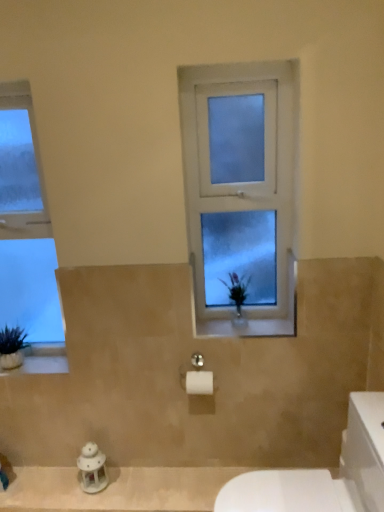
At what (x,y) coordinates should I click in order to perform the action: click on frosted glass window at center, the 2th window from the left. Please return your answer as a coordinate pair (x, y). This screenshot has width=384, height=512. Looking at the image, I should click on (241, 193).

Describe the element at coordinates (92, 468) in the screenshot. I see `white porcelain lantern at lower left` at that location.

What is the approximate height of white stone window sill at lower left?

The height of white stone window sill at lower left is 0.55 inches.

Find the location of a particular element. frosted glass window at center, positioned as the first window in right-to-left order is located at coordinates (241, 193).

How many degrees apart are the facing directions of clear glass window at left, the first window positioned from the left, and white glossy porcelain at lower right?

There is a 90-degree angle between the facing directions of clear glass window at left, the first window positioned from the left, and white glossy porcelain at lower right.

Is clear glass window at left, the first window positioned from the left, wider than white glossy porcelain at lower right?

In fact, clear glass window at left, the first window positioned from the left, might be narrower than white glossy porcelain at lower right.

Which is in front, point (39, 355) or point (264, 492)?

The point (264, 492) is closer.

Is clear glass window at left, the first window positioned from the left, turned away from white glossy porcelain at lower right?

clear glass window at left, the first window positioned from the left, is not turned away from white glossy porcelain at lower right.

Considering the positions of point (258, 490) and point (89, 492), is point (258, 490) closer or farther from the camera than point (89, 492)?

Point (258, 490) is positioned closer to the camera compared to point (89, 492).

Can you confirm if white glossy porcelain at lower right is taller than white porcelain lantern at lower left?

Yes, white glossy porcelain at lower right is taller than white porcelain lantern at lower left.

How many degrees apart are the facing directions of white glossy porcelain at lower right and white porcelain lantern at lower left?

The angular difference between white glossy porcelain at lower right and white porcelain lantern at lower left is 90 degrees.

Find the location of `porcelain above the white porcelain lantern at lower left (from a real-world perspective)`. porcelain above the white porcelain lantern at lower left (from a real-world perspective) is located at coordinates (322, 473).

Is frosted glass window at center, positioned as the first window in right-to-left order, taller or shorter than white porcelain lantern at lower left?

frosted glass window at center, positioned as the first window in right-to-left order, is taller than white porcelain lantern at lower left.

Is frosted glass window at center, positioned as the first window in right-to-left order, inside or outside of white porcelain lantern at lower left?

frosted glass window at center, positioned as the first window in right-to-left order, is spatially situated outside white porcelain lantern at lower left.

The image size is (384, 512). Identify the location of window that is on the right side of white porcelain lantern at lower left. (241, 193).

Consider the image. From the image's perspective, is frosted glass window at center, positioned as the first window in right-to-left order, located above white porcelain lantern at lower left?

Yes.

Considering the sizes of objects white porcelain lantern at lower left and white glossy porcelain at lower right in the image provided, who is wider, white porcelain lantern at lower left or white glossy porcelain at lower right?

With larger width is white glossy porcelain at lower right.

Does point (87, 480) come behind point (382, 454)?

Yes.

Does white porcelain lantern at lower left touch white glossy porcelain at lower right?

No, white porcelain lantern at lower left is not touching white glossy porcelain at lower right.

From the image's perspective, is frosted glass window at center, positioned as the first window in right-to-left order, located above white stone window sill at lower left?

Correct, frosted glass window at center, positioned as the first window in right-to-left order, appears higher than white stone window sill at lower left in the image.

Can you confirm if frosted glass window at center, positioned as the first window in right-to-left order, is positioned to the right of white stone window sill at lower left?

Yes, frosted glass window at center, positioned as the first window in right-to-left order, is to the right of white stone window sill at lower left.

Find the location of a particular element. Image resolution: width=384 pixels, height=512 pixels. window sill behind the frosted glass window at center, positioned as the first window in right-to-left order is located at coordinates (41, 360).

How different are the orientations of frosted glass window at center, positioned as the first window in right-to-left order, and white stone window sill at lower left in degrees?

The angle between the facing direction of frosted glass window at center, positioned as the first window in right-to-left order, and the facing direction of white stone window sill at lower left is 7.15e-05 degrees.

From a real-world perspective, between white porcelain lantern at lower left and frosted glass window at center, the 2th window from the left, who is vertically lower?

white porcelain lantern at lower left.

Can you confirm if white porcelain lantern at lower left is taller than frosted glass window at center, the 2th window from the left?

No.

Based on the photo, which is more to the left, white porcelain lantern at lower left or frosted glass window at center, the 2th window from the left?

white porcelain lantern at lower left.

Can frosted glass window at center, the 2th window from the left, be found inside white porcelain lantern at lower left?

No, frosted glass window at center, the 2th window from the left, is not inside white porcelain lantern at lower left.

From a real-world perspective, is white stone window sill at lower left located higher than white porcelain lantern at lower left?

Yes, from a real-world perspective, white stone window sill at lower left is on top of white porcelain lantern at lower left.

What's the angular difference between white stone window sill at lower left and white porcelain lantern at lower left's facing directions?

2.22e-05 degrees separate the facing orientations of white stone window sill at lower left and white porcelain lantern at lower left.

Visually, is white stone window sill at lower left positioned to the left or to the right of white porcelain lantern at lower left?

In the image, white stone window sill at lower left appears on the left side of white porcelain lantern at lower left.

Does white stone window sill at lower left come behind white porcelain lantern at lower left?

Yes, it is.

Find the location of a particular element. the 1st window directly above the white glossy porcelain at lower right (from a real-world perspective) is located at coordinates (27, 239).

Where is `figurine that appears on the left of white glossy porcelain at lower right`? This screenshot has width=384, height=512. figurine that appears on the left of white glossy porcelain at lower right is located at coordinates (92, 468).

From the image, which object appears to be farther from clear glass window at left, the second window viewed from the right, frosted glass window at center, the 2th window from the left, or white porcelain lantern at lower left?

Among the two, frosted glass window at center, the 2th window from the left, is located further to clear glass window at left, the second window viewed from the right.

Which object lies nearer to the anchor point clear glass window at left, the second window viewed from the right, white porcelain lantern at lower left or frosted glass window at center, the 2th window from the left?

white porcelain lantern at lower left.

Estimate the real-world distances between objects in this image. Which object is further from white stone window sill at lower left, frosted glass window at center, positioned as the first window in right-to-left order, or clear glass window at left, the first window positioned from the left?

frosted glass window at center, positioned as the first window in right-to-left order, lies further to white stone window sill at lower left than the other object.

Estimate the real-world distances between objects in this image. Which object is closer to white porcelain lantern at lower left, white stone window sill at lower left or frosted glass window at center, the 2th window from the left?

Based on the image, white stone window sill at lower left appears to be nearer to white porcelain lantern at lower left.

From the image, which object appears to be nearer to clear glass window at left, the second window viewed from the right, frosted glass window at center, positioned as the first window in right-to-left order, or white stone window sill at lower left?

white stone window sill at lower left is positioned closer to the anchor clear glass window at left, the second window viewed from the right.

Which object lies further to the anchor point frosted glass window at center, positioned as the first window in right-to-left order, clear glass window at left, the second window viewed from the right, or white porcelain lantern at lower left?

white porcelain lantern at lower left.

When comparing their distances from clear glass window at left, the second window viewed from the right, does white porcelain lantern at lower left or white glossy porcelain at lower right seem closer?

The object closer to clear glass window at left, the second window viewed from the right, is white porcelain lantern at lower left.

Which object lies further to the anchor point white glossy porcelain at lower right, clear glass window at left, the first window positioned from the left, or white porcelain lantern at lower left?

clear glass window at left, the first window positioned from the left, is further to white glossy porcelain at lower right.

At what (x,y) coordinates should I click in order to perform the action: click on window sill between clear glass window at left, the second window viewed from the right, and frosted glass window at center, the 2th window from the left, from left to right. Please return your answer as a coordinate pair (x, y). The width and height of the screenshot is (384, 512). Looking at the image, I should click on (41, 360).

The height and width of the screenshot is (512, 384). What are the coordinates of `window between frosted glass window at center, the 2th window from the left, and white porcelain lantern at lower left from top to bottom` in the screenshot? It's located at (27, 239).

At what (x,y) coordinates should I click in order to perform the action: click on window sill between clear glass window at left, the second window viewed from the right, and white porcelain lantern at lower left vertically. Please return your answer as a coordinate pair (x, y). This screenshot has height=512, width=384. Looking at the image, I should click on (41, 360).

You are a GUI agent. You are given a task and a screenshot of the screen. Output one action in this format:
    pyautogui.click(x=<x>, y=<y>)
    Task: Click on the figurine between white stone window sill at lower left and white glossy porcelain at lower right
    The image size is (384, 512).
    Given the screenshot: What is the action you would take?
    pyautogui.click(x=92, y=468)